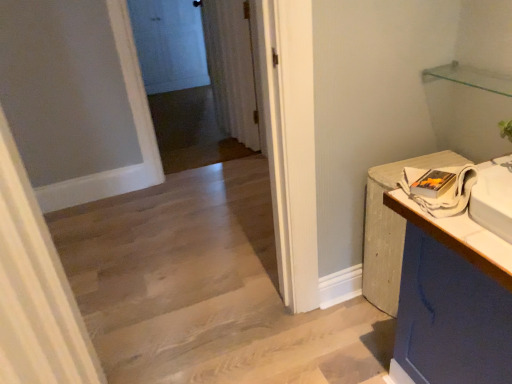
Question: Is white textured curtain at left, which appears as the 1th curtain when ordered from the bottom, not within white wood counter at right?

Choices:
 (A) yes
 (B) no

Answer: (A)

Question: Considering the relative sizes of white textured curtain at left, which is the second curtain from back to front, and white wood counter at right in the image provided, is white textured curtain at left, which is the second curtain from back to front, wider than white wood counter at right?

Choices:
 (A) yes
 (B) no

Answer: (B)

Question: From a real-world perspective, is white textured curtain at left, acting as the second curtain starting from the top, physically below white wood counter at right?

Choices:
 (A) no
 (B) yes

Answer: (A)

Question: Is white textured curtain at left, the first curtain when ordered from front to back, positioned behind white wood counter at right?

Choices:
 (A) no
 (B) yes

Answer: (A)

Question: Is white textured curtain at left, which appears as the 1th curtain when ordered from the bottom, next to white wood counter at right?

Choices:
 (A) yes
 (B) no

Answer: (B)

Question: In terms of size, does white textured curtain at left, which is the second curtain from back to front, appear bigger or smaller than white glossy door at upper center?

Choices:
 (A) big
 (B) small

Answer: (A)

Question: Is white textured curtain at left, the first curtain when ordered from front to back, situated inside white glossy door at upper center or outside?

Choices:
 (A) outside
 (B) inside

Answer: (A)

Question: Is point (10, 160) closer or farther from the camera than point (194, 66)?

Choices:
 (A) farther
 (B) closer

Answer: (B)

Question: Is white textured curtain at left, acting as the second curtain starting from the top, to the left or to the right of white glossy door at upper center in the image?

Choices:
 (A) right
 (B) left

Answer: (A)

Question: Is white wood counter at right taller or shorter than white textured curtain at left, the first curtain when ordered from front to back?

Choices:
 (A) tall
 (B) short

Answer: (B)

Question: In the image, is white wood counter at right on the left side or the right side of white textured curtain at left, which appears as the 1th curtain when ordered from the bottom?

Choices:
 (A) right
 (B) left

Answer: (A)

Question: From a real-world perspective, is white wood counter at right physically located above or below white textured curtain at left, acting as the second curtain starting from the top?

Choices:
 (A) above
 (B) below

Answer: (B)

Question: From the image's perspective, is white wood counter at right above or below white textured curtain at left, which appears as the 1th curtain when ordered from the bottom?

Choices:
 (A) below
 (B) above

Answer: (B)

Question: Is white wood counter at right taller or shorter than white sheer curtain at center, the 2th curtain from the bottom?

Choices:
 (A) tall
 (B) short

Answer: (B)

Question: From a real-world perspective, is white wood counter at right physically located above or below white sheer curtain at center, positioned as the first curtain in top-to-bottom order?

Choices:
 (A) below
 (B) above

Answer: (A)